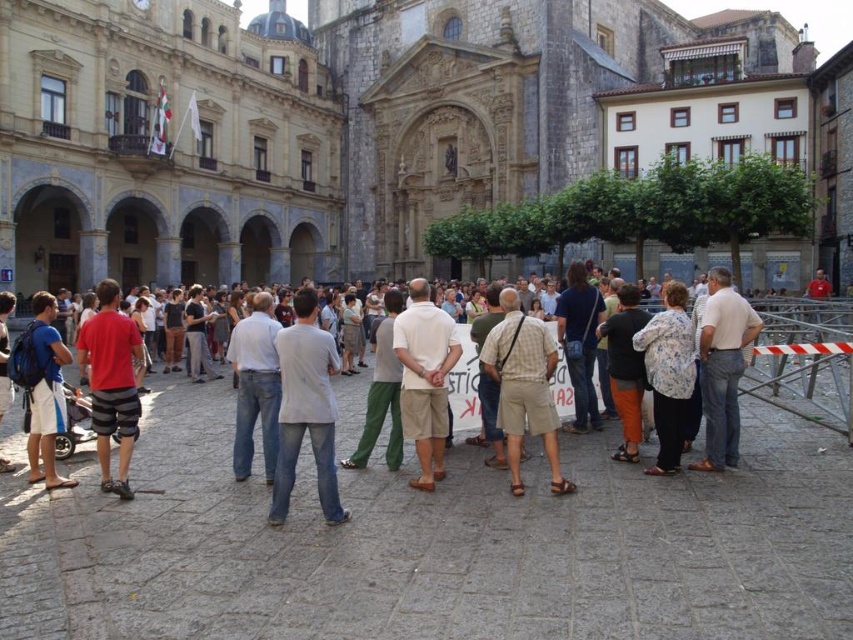
Question: Does plaid cotton shirt at center appear under floral-patterned blouse at lower right?

Choices:
 (A) yes
 (B) no

Answer: (A)

Question: Which of the following is the closest to the observer?

Choices:
 (A) (502, 412)
 (B) (672, 355)

Answer: (B)

Question: Is plaid cotton shirt at center bigger than floral-patterned blouse at lower right?

Choices:
 (A) yes
 (B) no

Answer: (B)

Question: Can you confirm if plaid cotton shirt at center is positioned below floral-patterned blouse at lower right?

Choices:
 (A) no
 (B) yes

Answer: (B)